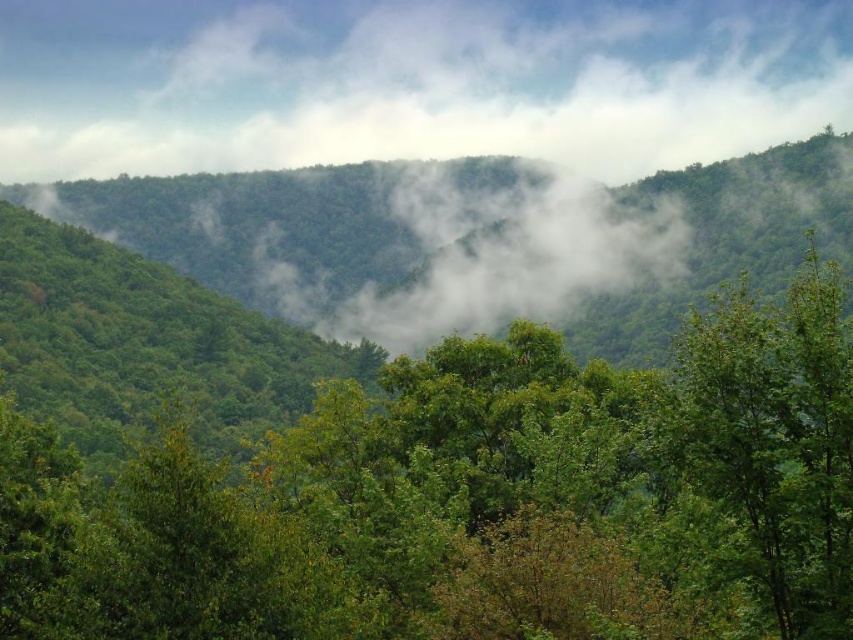
You are an artist trying to paint this mountain landscape. You want to place a small bird in the scene such that it is positioned exactly at the same 2D coordinates as the white misty cloud at upper center. What are the coordinates where you should place the bird?

The coordinates for the white misty cloud at upper center are at point (412, 83), so you should place the bird at the same coordinates, which is (412, 83).

Based on the photo, you are standing in the mountainous landscape and want to take a photo of the green leafy tree at center and the white fluffy cloud at center. Which object should you focus on first to ensure both are in sharp focus?

You should focus on the green leafy tree at center first because it is closer to the viewer than the white fluffy cloud at center, so adjusting focus from near to far will help both be in sharp focus.